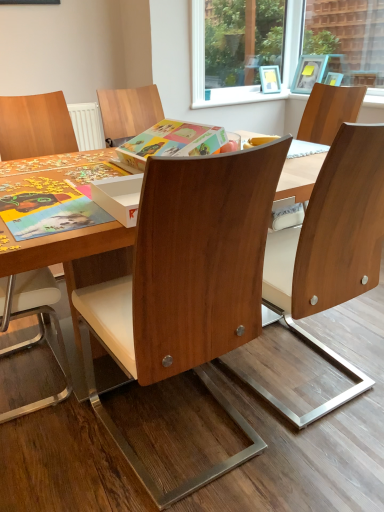
Question: From a real-world perspective, is wooden chair at left, which is the 3th chair in right-to-left order, on wooden chair at center, the first chair viewed from the right?

Choices:
 (A) yes
 (B) no

Answer: (B)

Question: Does wooden chair at left, the 1th chair in the left-to-right sequence, have a lesser width compared to wooden chair at center, acting as the 3th chair starting from the left?

Choices:
 (A) yes
 (B) no

Answer: (A)

Question: Is wooden chair at left, which is the 3th chair in right-to-left order, facing away from wooden chair at center, the first chair viewed from the right?

Choices:
 (A) yes
 (B) no

Answer: (B)

Question: Is wooden chair at left, which is the 3th chair in right-to-left order, next to wooden chair at center, the first chair viewed from the right?

Choices:
 (A) no
 (B) yes

Answer: (A)

Question: From the image's perspective, would you say wooden chair at left, which is the 3th chair in right-to-left order, is shown under wooden chair at center, the first chair viewed from the right?

Choices:
 (A) yes
 (B) no

Answer: (A)

Question: From the image's perspective, is wooden chair at center, arranged as the second chair when viewed from the right, above or below wooden chair at center, acting as the 3th chair starting from the left?

Choices:
 (A) below
 (B) above

Answer: (A)

Question: From a real-world perspective, relative to wooden chair at center, the first chair viewed from the right, is wooden chair at center, arranged as the second chair when viewed from the right, vertically above or below?

Choices:
 (A) below
 (B) above

Answer: (B)

Question: In terms of size, does wooden chair at center, the 2th chair in the left-to-right sequence, appear bigger or smaller than wooden chair at center, acting as the 3th chair starting from the left?

Choices:
 (A) big
 (B) small

Answer: (A)

Question: In terms of height, does wooden chair at center, the 2th chair in the left-to-right sequence, look taller or shorter compared to wooden chair at center, acting as the 3th chair starting from the left?

Choices:
 (A) tall
 (B) short

Answer: (A)

Question: Is point (327, 224) closer or farther from the camera than point (304, 72)?

Choices:
 (A) farther
 (B) closer

Answer: (B)

Question: From a real-world perspective, is wooden chair at center, the first chair viewed from the right, positioned above or below wooden picture frame at upper right?

Choices:
 (A) below
 (B) above

Answer: (A)

Question: Considering the positions of wooden chair at center, acting as the 3th chair starting from the left, and wooden picture frame at upper right in the image, is wooden chair at center, acting as the 3th chair starting from the left, wider or thinner than wooden picture frame at upper right?

Choices:
 (A) wide
 (B) thin

Answer: (A)

Question: Considering the relative positions of wooden chair at center, the first chair viewed from the right, and wooden picture frame at upper right in the image provided, is wooden chair at center, the first chair viewed from the right, to the left or to the right of wooden picture frame at upper right?

Choices:
 (A) left
 (B) right

Answer: (A)

Question: Based on their sizes in the image, would you say wooden picture frame at upper right is bigger or smaller than wooden chair at center, the first chair viewed from the right?

Choices:
 (A) small
 (B) big

Answer: (A)

Question: From a real-world perspective, is wooden picture frame at upper right physically located above or below wooden chair at center, acting as the 3th chair starting from the left?

Choices:
 (A) above
 (B) below

Answer: (A)